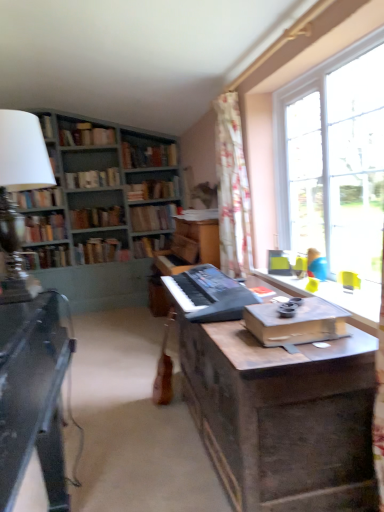
Locate an element on the screen. This screenshot has width=384, height=512. vacant space to the left of wooden desk at center is located at coordinates (137, 468).